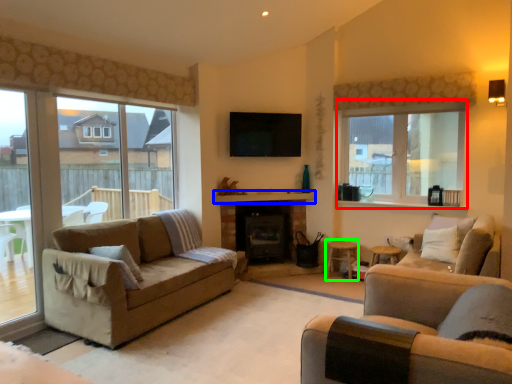
Question: Which object is positioned farthest from window (highlighted by a red box)? Select from mantle (highlighted by a blue box) and stool (highlighted by a green box).

Choices:
 (A) mantle
 (B) stool

Answer: (B)